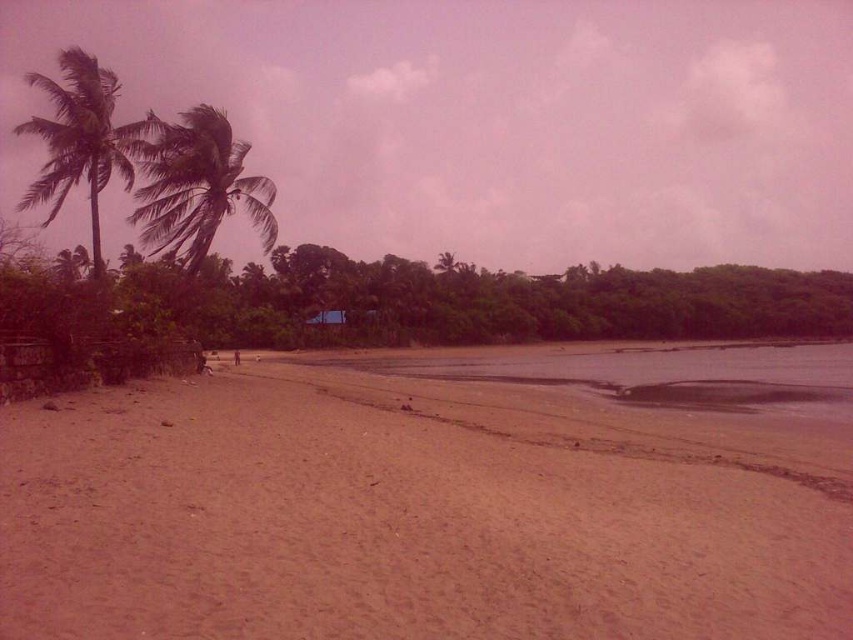
Question: Considering the real-world distances, which object is closest to the green leafy palm tree at upper left?

Choices:
 (A) sandy beach at lower left
 (B) green leafy palm tree at left

Answer: (B)

Question: Based on their relative distances, which object is farther from the sandy beach at lower left?

Choices:
 (A) green leafy palm tree at upper left
 (B) green leafy palm tree at left

Answer: (A)

Question: Can you confirm if sandy beach at lower left is bigger than green leafy palm tree at upper left?

Choices:
 (A) no
 (B) yes

Answer: (A)

Question: Is green leafy palm tree at left behind green leafy palm tree at upper left?

Choices:
 (A) yes
 (B) no

Answer: (A)

Question: Which point appears farthest from the camera in this image?

Choices:
 (A) (32, 452)
 (B) (22, 131)

Answer: (B)

Question: Can you confirm if green leafy palm tree at left is positioned to the left of green leafy palm tree at upper left?

Choices:
 (A) yes
 (B) no

Answer: (B)